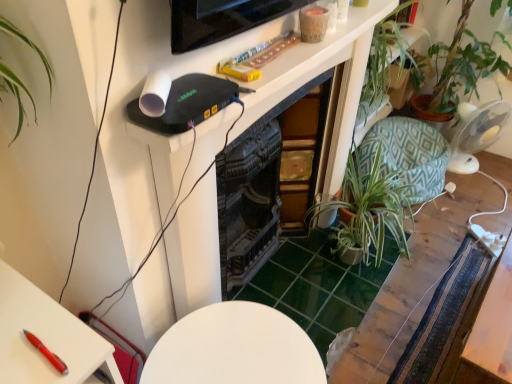
Question: Does green leafy plant at center-right appear on the left side of wooden table at lower right, marked as the second table in a back-to-front arrangement?

Choices:
 (A) no
 (B) yes

Answer: (B)

Question: Can you confirm if green leafy plant at center-right is shorter than wooden table at lower right, the 2th table when ordered from front to back?

Choices:
 (A) no
 (B) yes

Answer: (B)

Question: Can you confirm if green leafy plant at center-right is taller than wooden table at lower right, marked as the second table in a back-to-front arrangement?

Choices:
 (A) yes
 (B) no

Answer: (B)

Question: Would you say green leafy plant at center-right is a long distance from wooden table at lower right, marked as the second table in a back-to-front arrangement?

Choices:
 (A) no
 (B) yes

Answer: (A)

Question: Can you see green leafy plant at center-right touching wooden table at lower right, the 2th table when ordered from front to back?

Choices:
 (A) yes
 (B) no

Answer: (B)

Question: Can you confirm if green leafy plant at center-right is wider than wooden table at lower right, marked as the second table in a back-to-front arrangement?

Choices:
 (A) yes
 (B) no

Answer: (B)

Question: Does wooden table at lower right, marked as the second table in a back-to-front arrangement, touch wooden table at center, which ranks as the 3th table in front-to-back order?

Choices:
 (A) no
 (B) yes

Answer: (A)

Question: Considering the relative positions of wooden table at lower right, the 2th table when ordered from front to back, and wooden table at center, which is counted as the first table, starting from the back, in the image provided, is wooden table at lower right, the 2th table when ordered from front to back, in front of wooden table at center, which is counted as the first table, starting from the back,?

Choices:
 (A) no
 (B) yes

Answer: (B)

Question: Can you confirm if wooden table at lower right, marked as the second table in a back-to-front arrangement, is thinner than wooden table at center, which ranks as the 3th table in front-to-back order?

Choices:
 (A) yes
 (B) no

Answer: (B)

Question: From a real-world perspective, is wooden table at lower right, marked as the second table in a back-to-front arrangement, positioned under wooden table at center, which is counted as the first table, starting from the back, based on gravity?

Choices:
 (A) yes
 (B) no

Answer: (B)

Question: Is wooden table at lower right, marked as the second table in a back-to-front arrangement, wider than wooden table at center, which is counted as the first table, starting from the back?

Choices:
 (A) no
 (B) yes

Answer: (B)

Question: Does wooden table at lower right, the 2th table when ordered from front to back, have a smaller size compared to wooden table at center, which is counted as the first table, starting from the back?

Choices:
 (A) yes
 (B) no

Answer: (B)

Question: Is green leafy plant at center-right looking in the opposite direction of wooden table at center, which ranks as the 3th table in front-to-back order?

Choices:
 (A) yes
 (B) no

Answer: (B)